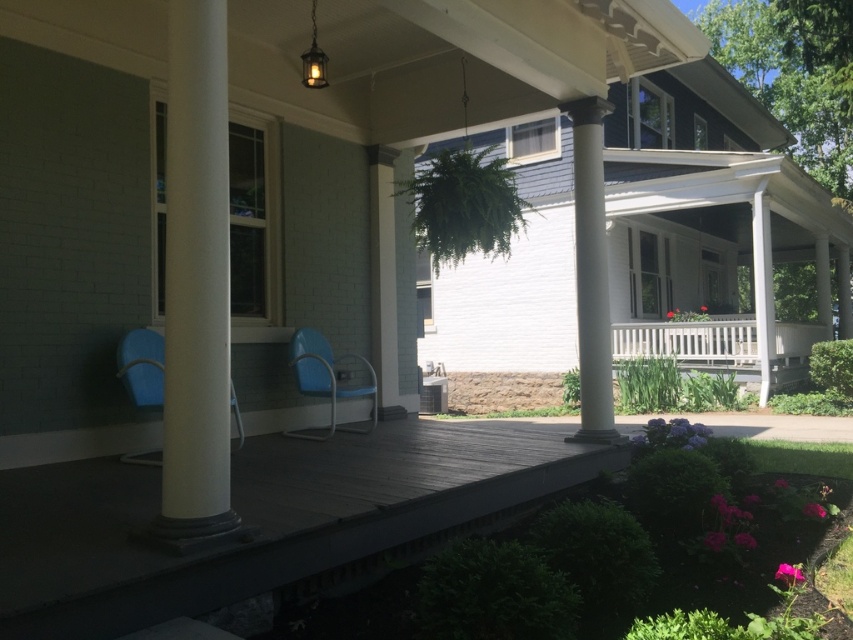
Can you confirm if white polished column at center is positioned to the left of white wooden railing at center?

Indeed, white polished column at center is positioned on the left side of white wooden railing at center.

Can you confirm if white polished column at center is thinner than white wooden railing at center?

Indeed, white polished column at center has a lesser width compared to white wooden railing at center.

Where is `white polished column at center`? This screenshot has width=853, height=640. white polished column at center is located at coordinates (590, 273).

Does white polished column at center have a lesser width compared to white smooth column at center?

No, white polished column at center is not thinner than white smooth column at center.

What do you see at coordinates (590, 273) in the screenshot?
I see `white polished column at center` at bounding box center [590, 273].

Is point (579, 228) behind point (759, 321)?

No, (579, 228) is closer to viewer.

Locate an element on the screen. This screenshot has width=853, height=640. white polished column at center is located at coordinates coord(590,273).

Can you confirm if white wooden railing at center is shorter than blue plastic rocking chair at center?

Incorrect, white wooden railing at center's height does not fall short of blue plastic rocking chair at center's.

Describe the element at coordinates (724, 348) in the screenshot. I see `white wooden railing at center` at that location.

Between point (799, 356) and point (125, 372), which one is positioned behind?

Positioned behind is point (799, 356).

Locate an element on the screen. white wooden railing at center is located at coordinates (724, 348).